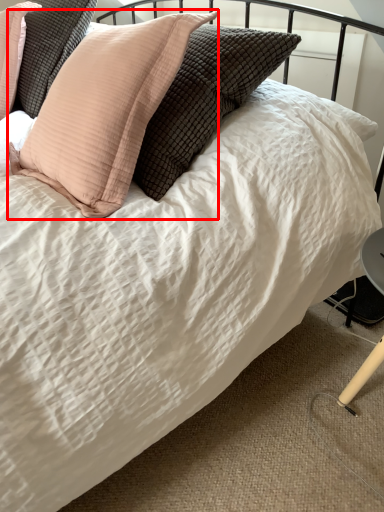
Question: From the image, what is the correct spatial relationship of pillow (annotated by the red box) in relation to pillow?

Choices:
 (A) left
 (B) right

Answer: (B)